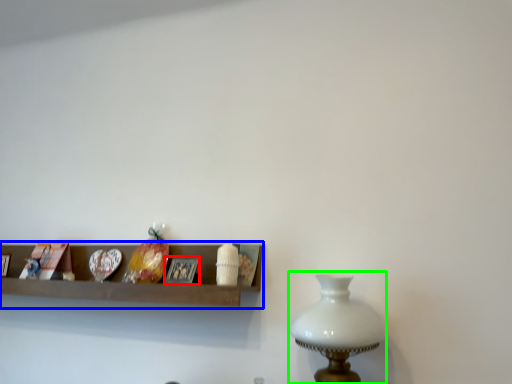
Question: Which object is the farthest from picture frame (highlighted by a red box)? Choose among these: shelf (highlighted by a blue box) or table lamp (highlighted by a green box).

Choices:
 (A) shelf
 (B) table lamp

Answer: (B)